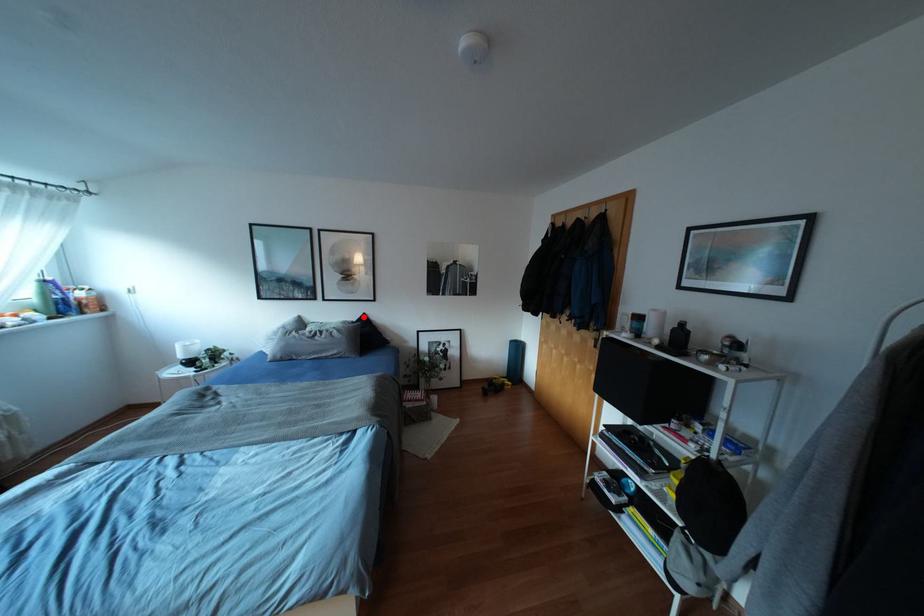
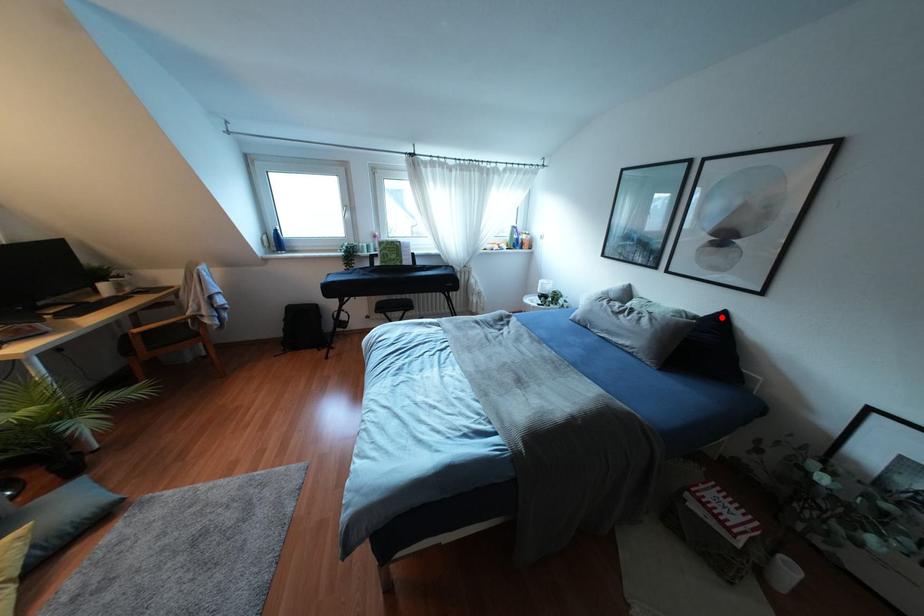
I am providing you with two images of the same scene from different viewpoints. A red point is marked on the first image and another point is marked on the second image. Is the marked point in image1 the same physical position as the marked point in image2?

Yes